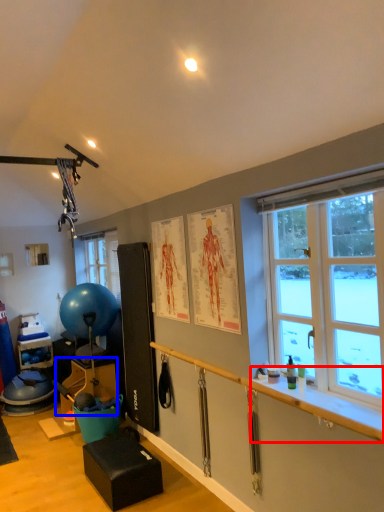
Question: Which point is further to the camera, window sill (highlighted by a red box) or furniture (highlighted by a blue box)?

Choices:
 (A) window sill
 (B) furniture

Answer: (B)